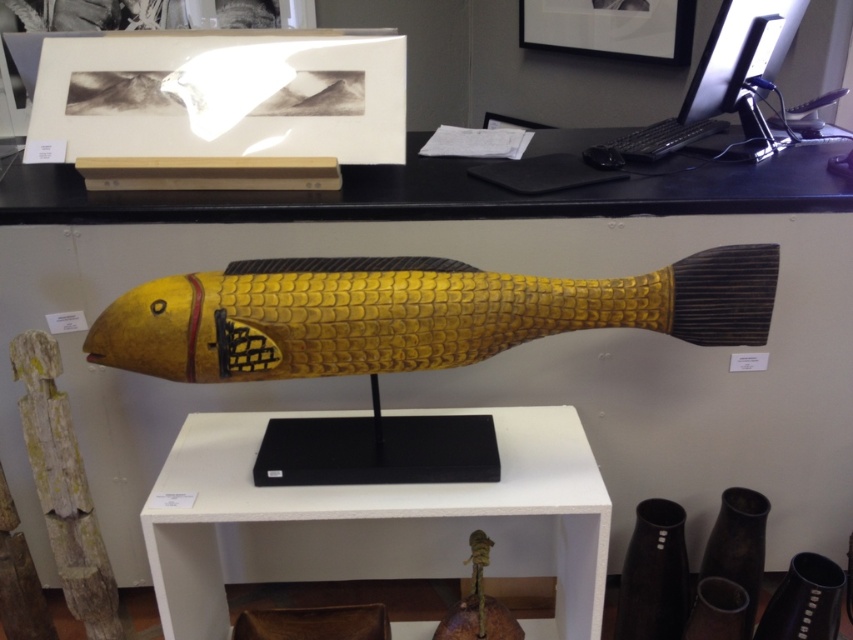
Question: Among these points, which one is farthest from the camera?

Choices:
 (A) [374, 340]
 (B) [170, 572]

Answer: (B)

Question: Where is yellow wood fish at center located in relation to black plastic monitor at upper right in the image?

Choices:
 (A) above
 (B) below

Answer: (B)

Question: Can you confirm if white matte shelf at center is bigger than yellow wood fish at center?

Choices:
 (A) yes
 (B) no

Answer: (A)

Question: Does yellow wood fish at center appear over black plastic monitor at upper right?

Choices:
 (A) yes
 (B) no

Answer: (B)

Question: Which is nearer to the black plastic monitor at upper right?

Choices:
 (A) yellow wood fish at center
 (B) white matte shelf at center

Answer: (A)

Question: Which object appears farthest from the camera in this image?

Choices:
 (A) yellow wood fish at center
 (B) black plastic monitor at upper right
 (C) white matte shelf at center

Answer: (B)